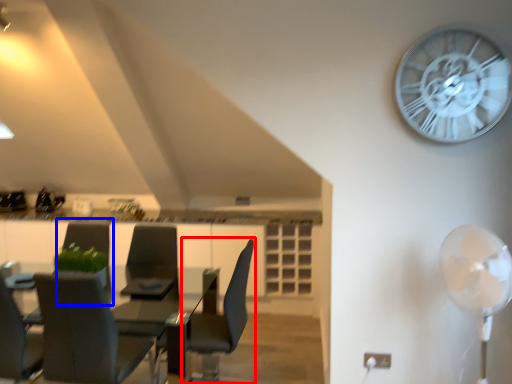
Question: Among these objects, which one is nearest to the camera, chair (highlighted by a red box) or armchair (highlighted by a blue box)?

Choices:
 (A) chair
 (B) armchair

Answer: (A)